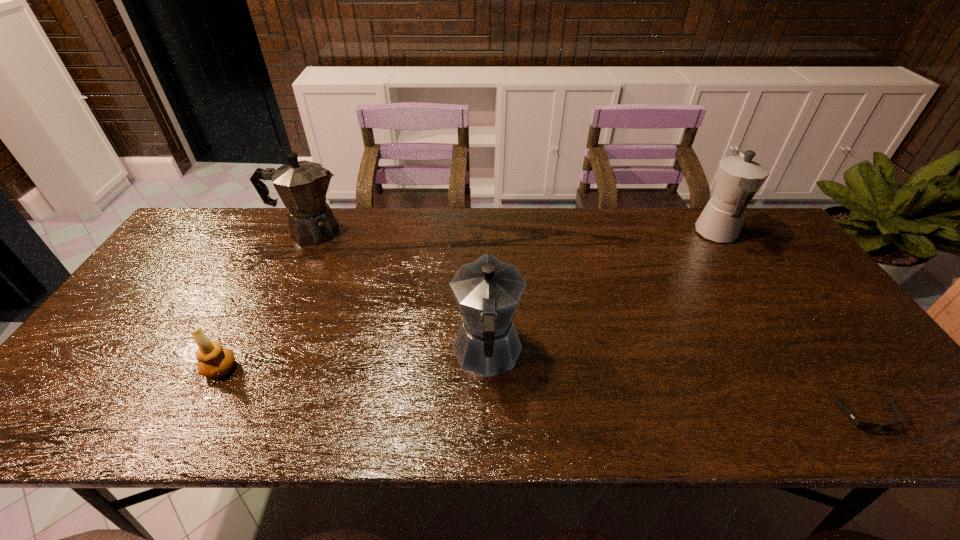
Image resolution: width=960 pixels, height=540 pixels. In the image, there is a desktop. What are the coordinates of `free region at the right edge` in the screenshot? It's located at [x=857, y=355].

The height and width of the screenshot is (540, 960). What are the coordinates of `free spot between the nearest coffeepot and the sunglasses` in the screenshot? It's located at coord(674,381).

What are the coordinates of `free space that is in between the leftmost coffeepot and the second coffeepot from right to left` in the screenshot? It's located at (398, 292).

The width and height of the screenshot is (960, 540). Find the location of `vacant space that's between the shortest object and the leftmost coffeepot`. vacant space that's between the shortest object and the leftmost coffeepot is located at coordinates (585, 321).

Locate an element on the screen. vacant space in between the leftmost coffeepot and the sunglasses is located at coordinates (585, 321).

The width and height of the screenshot is (960, 540). Identify the location of empty space between the second shortest object and the second coffeepot from left to right. (353, 360).

Where is `unoccupied position between the candle_holder and the nearest coffeepot`? The height and width of the screenshot is (540, 960). unoccupied position between the candle_holder and the nearest coffeepot is located at coordinates (353, 360).

Identify the location of vacant region between the candle_holder and the leftmost coffeepot. (265, 300).

I want to click on free space that is in between the rightmost coffeepot and the leftmost coffeepot, so click(x=514, y=233).

The width and height of the screenshot is (960, 540). Find the location of `vacant area between the sunglasses and the fourth tallest object`. vacant area between the sunglasses and the fourth tallest object is located at coordinates (540, 389).